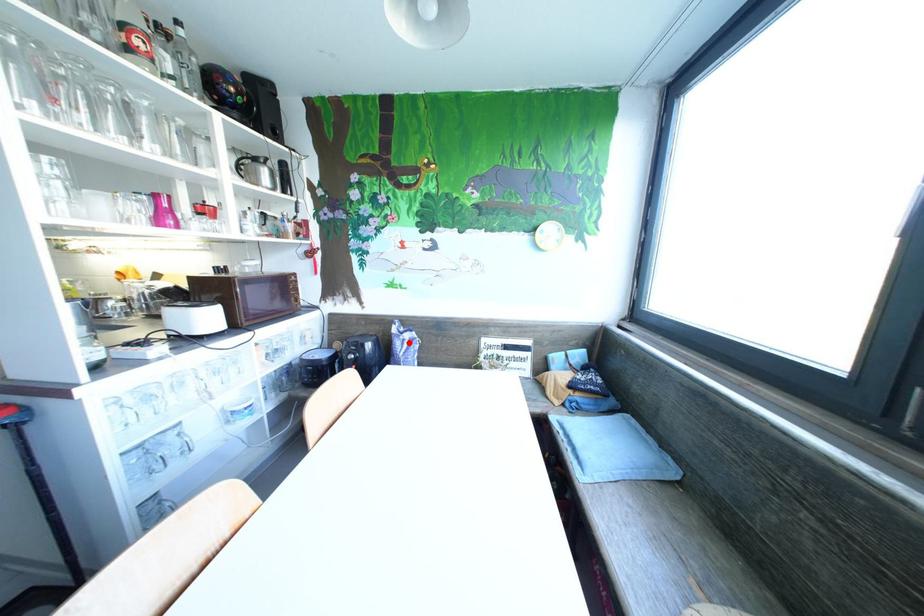
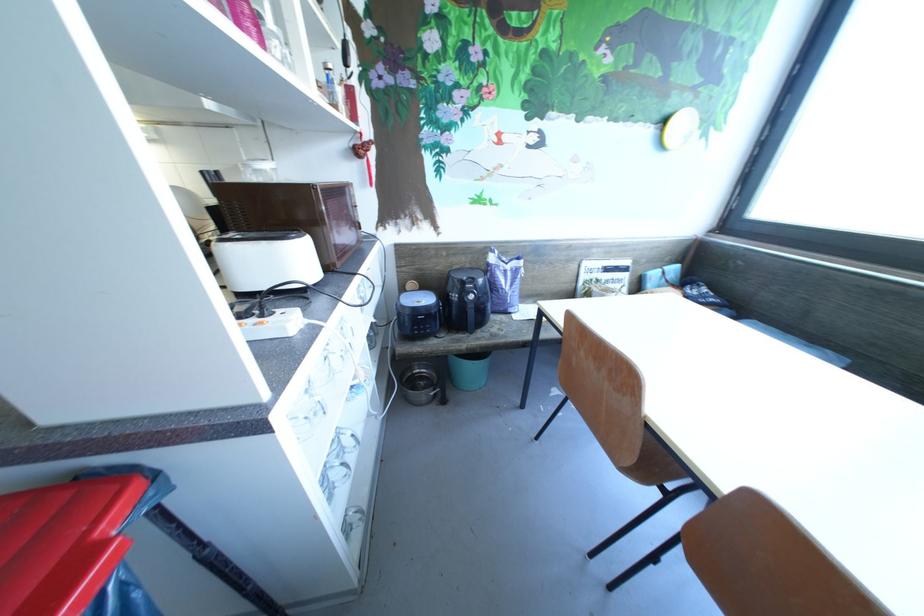
Find the pixel in the second image that matches the highlighted location in the first image.

(512, 274)